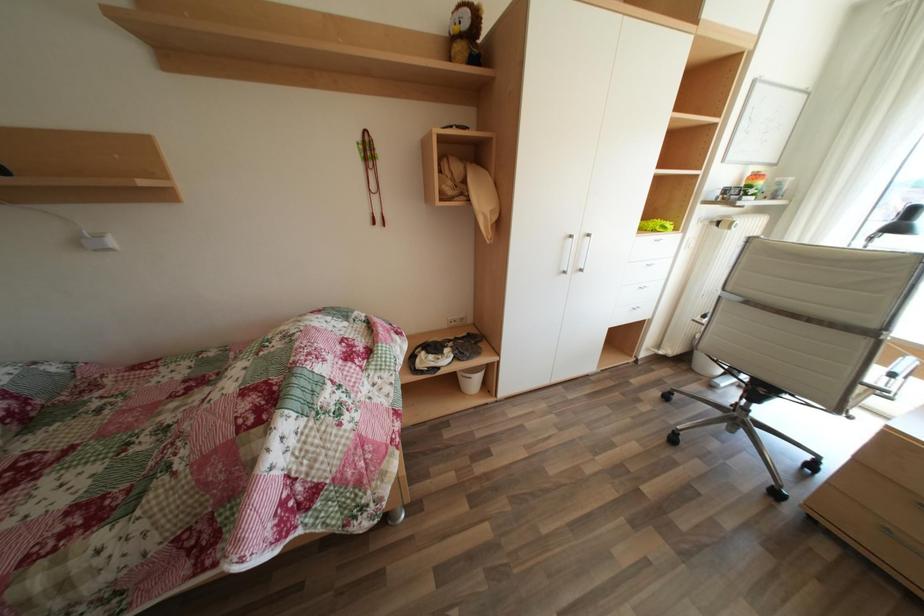
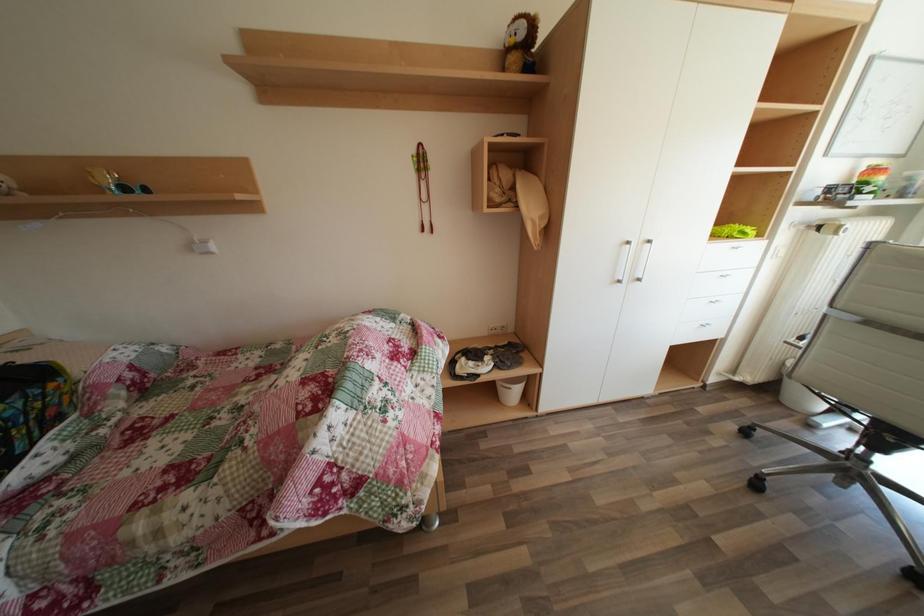
Question: The images are taken continuously from a first-person perspective. In which direction are you moving?

Choices:
 (A) Left
 (B) Right
 (C) Forward
 (D) Backward

Answer: (A)